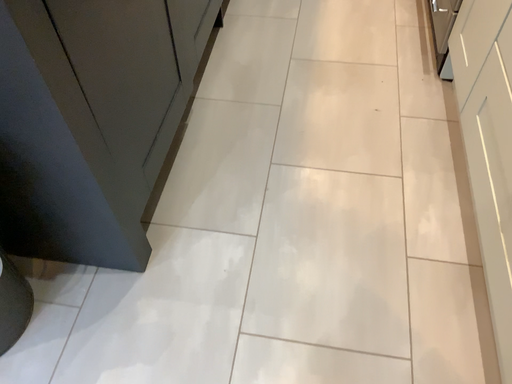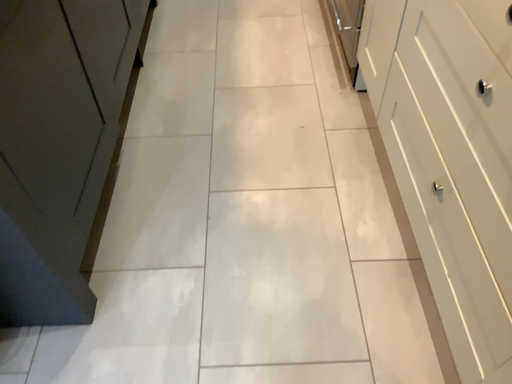
Question: How did the camera likely rotate when shooting the video?

Choices:
 (A) rotated left
 (B) rotated right

Answer: (B)